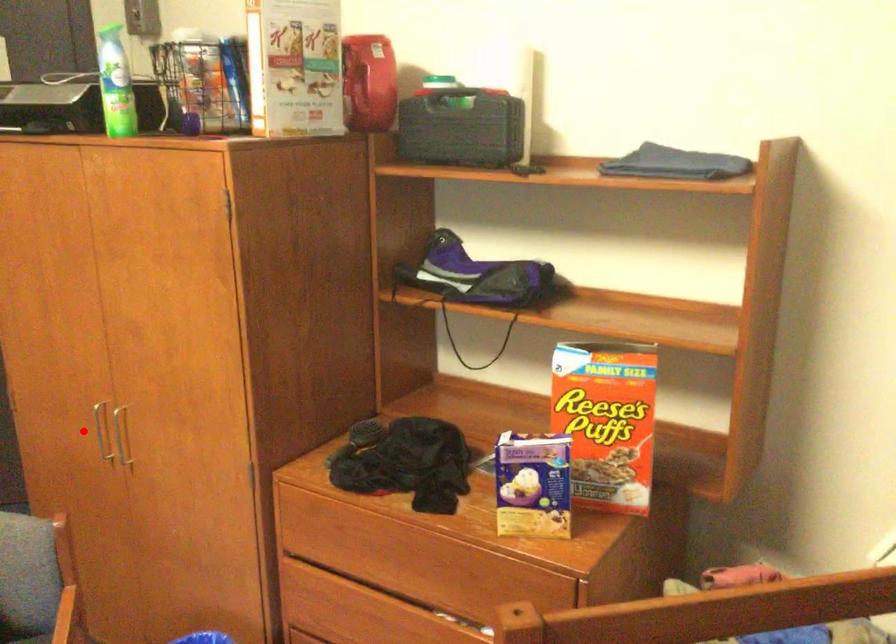
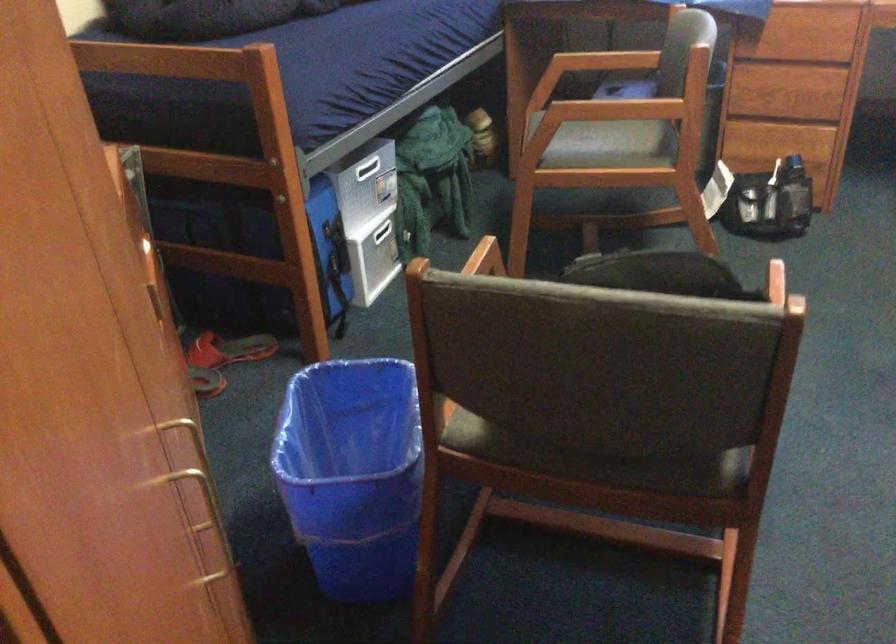
Find the pixel in the second image that matches the highlighted location in the first image.

(188, 419)